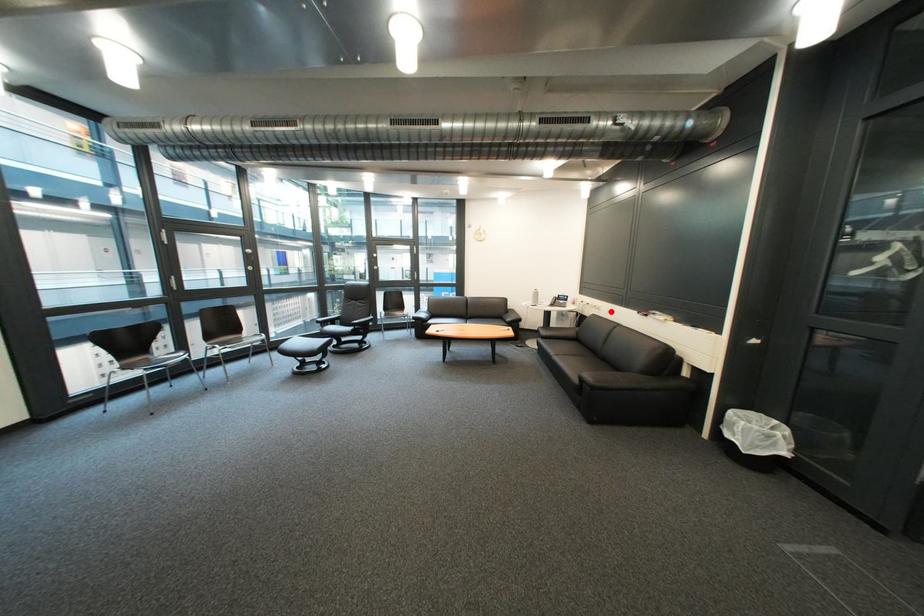
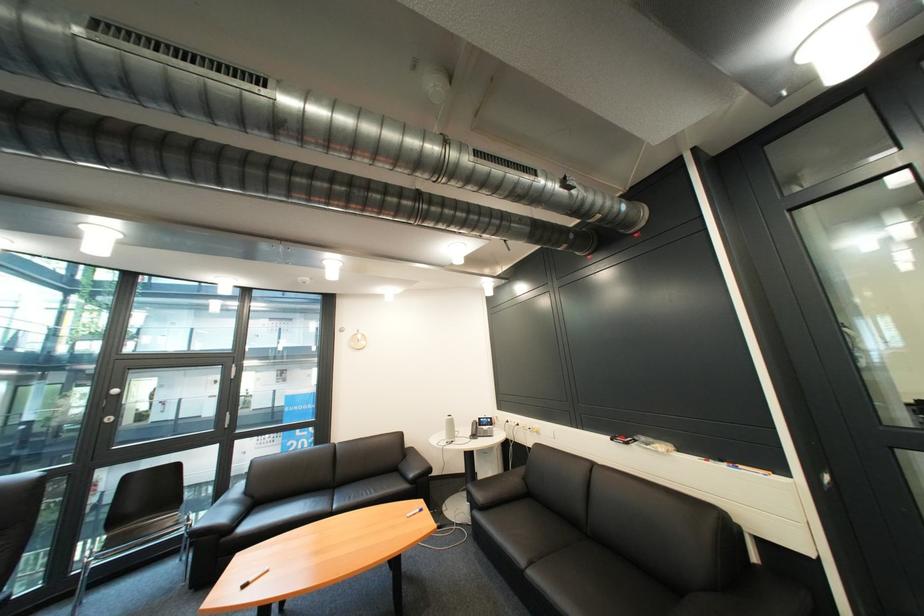
Question: I am providing you with two images of the same scene from different viewpoints. A red point is shown in image1. For the corresponding object point in image2, is it positioned nearer or farther from the camera?

Choices:
 (A) Nearer
 (B) Farther

Answer: (B)